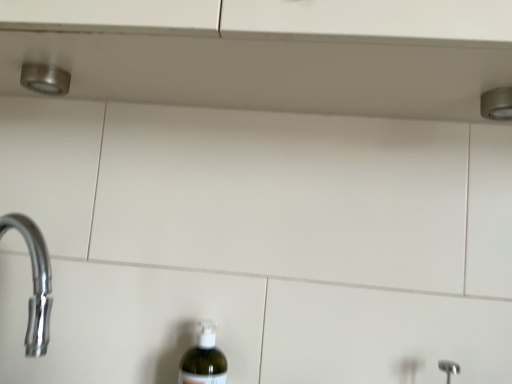
Question: Can you confirm if satin nickel shower at upper right is shorter than translucent plastic bottle at lower center?

Choices:
 (A) no
 (B) yes

Answer: (B)

Question: Considering the relative positions of satin nickel shower at upper right and translucent plastic bottle at lower center in the image provided, is satin nickel shower at upper right behind translucent plastic bottle at lower center?

Choices:
 (A) no
 (B) yes

Answer: (A)

Question: Does satin nickel shower at upper right have a greater width compared to translucent plastic bottle at lower center?

Choices:
 (A) yes
 (B) no

Answer: (B)

Question: Does satin nickel shower at upper right contain translucent plastic bottle at lower center?

Choices:
 (A) yes
 (B) no

Answer: (B)

Question: Is satin nickel shower at upper right oriented towards translucent plastic bottle at lower center?

Choices:
 (A) yes
 (B) no

Answer: (B)

Question: Does satin nickel shower at upper right have a larger size compared to translucent plastic bottle at lower center?

Choices:
 (A) no
 (B) yes

Answer: (A)

Question: Can you confirm if translucent plastic bottle at lower center is positioned to the right of satin nickel shower at upper right?

Choices:
 (A) yes
 (B) no

Answer: (B)

Question: Is the position of translucent plastic bottle at lower center more distant than that of satin nickel shower at upper right?

Choices:
 (A) yes
 (B) no

Answer: (A)

Question: Does translucent plastic bottle at lower center have a larger size compared to satin nickel shower at upper right?

Choices:
 (A) no
 (B) yes

Answer: (B)

Question: Is translucent plastic bottle at lower center next to satin nickel shower at upper right and touching it?

Choices:
 (A) yes
 (B) no

Answer: (B)

Question: Is satin nickel shower at upper right located within translucent plastic bottle at lower center?

Choices:
 (A) yes
 (B) no

Answer: (B)

Question: From the image's perspective, does translucent plastic bottle at lower center appear higher than satin nickel shower at upper right?

Choices:
 (A) no
 (B) yes

Answer: (A)

Question: Considering the positions of satin nickel shower at upper right and translucent plastic bottle at lower center in the image, is satin nickel shower at upper right bigger or smaller than translucent plastic bottle at lower center?

Choices:
 (A) small
 (B) big

Answer: (A)